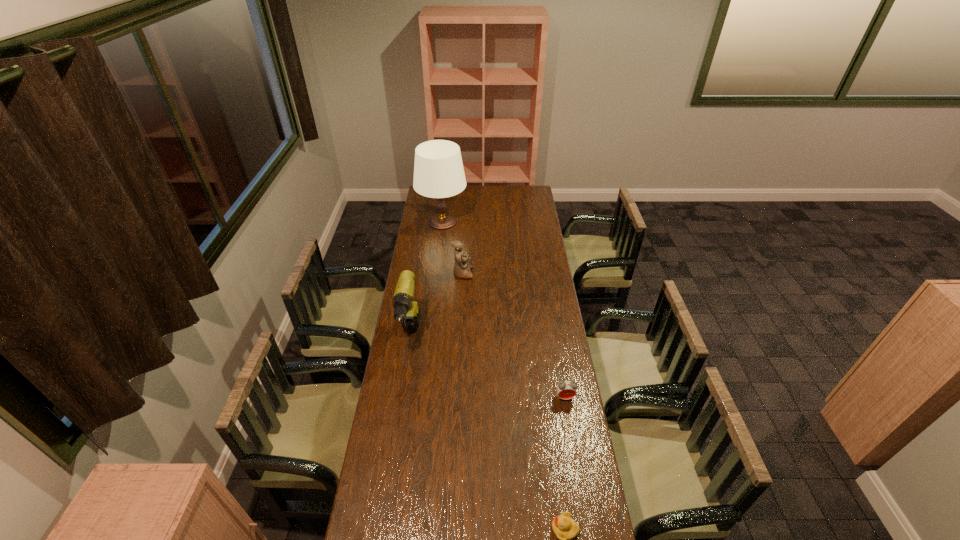
Where is `lamp`? The image size is (960, 540). lamp is located at coordinates (438, 169).

At what (x,y) coordinates should I click in order to perform the action: click on the farthest object. Please return your answer as a coordinate pair (x, y). This screenshot has width=960, height=540. Looking at the image, I should click on (438, 169).

I want to click on the third farthest object, so click(407, 311).

This screenshot has width=960, height=540. Find the location of `drill`. drill is located at coordinates (407, 311).

In order to click on the third shortest object in this screenshot , I will do `click(462, 266)`.

Identify the location of figurine. Image resolution: width=960 pixels, height=540 pixels. (462, 266).

Find the location of `alarm clock`. alarm clock is located at coordinates (566, 389).

Locate an element on the screen. The image size is (960, 540). the second nearest object is located at coordinates (566, 389).

Where is `vacant region located on the front of the farthest object`? The image size is (960, 540). vacant region located on the front of the farthest object is located at coordinates (440, 242).

I want to click on vacant space situated 0.330m on the handle side of the second tallest object, so click(x=394, y=437).